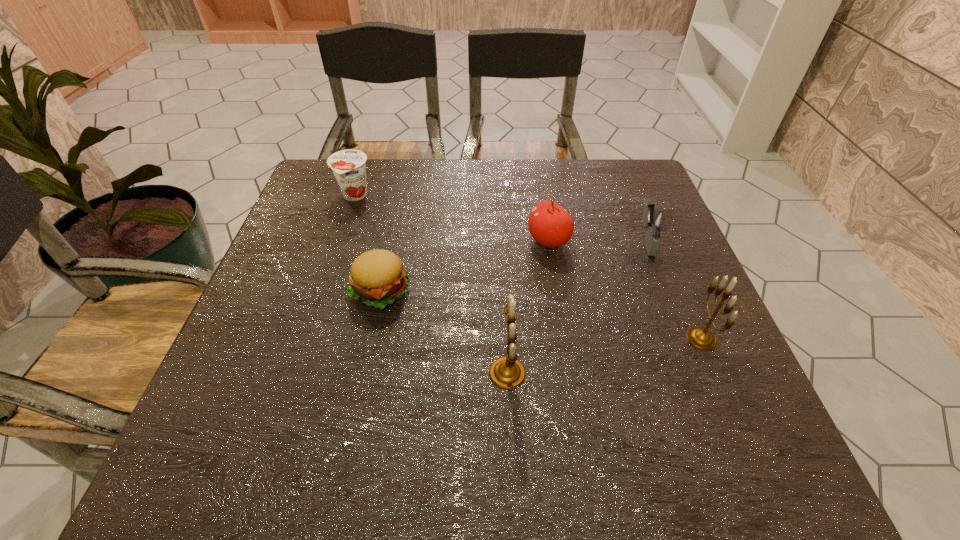
Locate an element on the screen. This screenshot has height=540, width=960. the taller candelabrum is located at coordinates (507, 372).

This screenshot has height=540, width=960. Identify the location of the tallest object. (507, 372).

Image resolution: width=960 pixels, height=540 pixels. Find the location of `the right candelabrum`. the right candelabrum is located at coordinates (702, 338).

I want to click on the second tallest object, so click(702, 338).

Locate an element on the screen. yogurt is located at coordinates (349, 168).

At what (x,y) coordinates should I click in order to perform the action: click on the farthest object. Please return your answer as a coordinate pair (x, y). Looking at the image, I should click on (349, 168).

At what (x,y) coordinates should I click in order to perform the action: click on the shortest object. Please return your answer as a coordinate pair (x, y). The height and width of the screenshot is (540, 960). Looking at the image, I should click on (377, 277).

Locate an element on the screen. the third nearest object is located at coordinates (377, 277).

Identify the location of the third object from right to left. (x=551, y=226).

Locate an element on the screen. This screenshot has height=540, width=960. igniter is located at coordinates (654, 221).